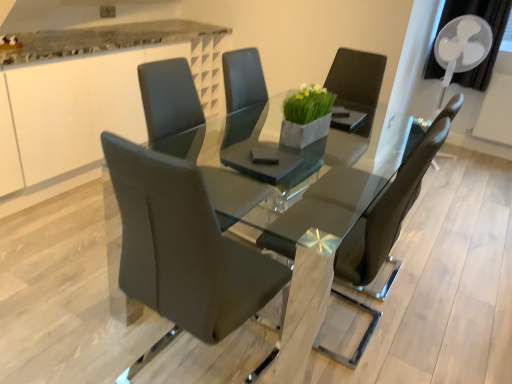
Question: In which direction should I rotate to look at matte black chair at center, which is counted as the first chair, starting from the front?

Choices:
 (A) right
 (B) left

Answer: (B)

Question: From the image's perspective, is high-gloss black table at center over matte black chair at center, the third chair viewed from the back?

Choices:
 (A) yes
 (B) no

Answer: (A)

Question: From a real-world perspective, is high-gloss black table at center positioned under matte black chair at center, which is counted as the first chair, starting from the front, based on gravity?

Choices:
 (A) yes
 (B) no

Answer: (A)

Question: Is high-gloss black table at center bigger than matte black chair at center, the third chair viewed from the back?

Choices:
 (A) yes
 (B) no

Answer: (A)

Question: Is high-gloss black table at center in contact with matte black chair at center, the third chair viewed from the back?

Choices:
 (A) yes
 (B) no

Answer: (B)

Question: Is high-gloss black table at center positioned behind matte black chair at center, the third chair viewed from the back?

Choices:
 (A) yes
 (B) no

Answer: (A)

Question: Does high-gloss black table at center have a greater width compared to matte black chair at center, the third chair viewed from the back?

Choices:
 (A) yes
 (B) no

Answer: (A)

Question: Is white plastic mechanical fan at upper right taller than high-gloss black table at center?

Choices:
 (A) no
 (B) yes

Answer: (B)

Question: Is white plastic mechanical fan at upper right touching high-gloss black table at center?

Choices:
 (A) no
 (B) yes

Answer: (A)

Question: From the image's perspective, is white plastic mechanical fan at upper right on top of high-gloss black table at center?

Choices:
 (A) no
 (B) yes

Answer: (B)

Question: Considering the relative positions of white plastic mechanical fan at upper right and high-gloss black table at center in the image provided, is white plastic mechanical fan at upper right to the right of high-gloss black table at center from the viewer's perspective?

Choices:
 (A) yes
 (B) no

Answer: (A)

Question: Is white plastic mechanical fan at upper right closer to camera compared to high-gloss black table at center?

Choices:
 (A) yes
 (B) no

Answer: (B)

Question: Is high-gloss black table at center at the back of white plastic mechanical fan at upper right?

Choices:
 (A) yes
 (B) no

Answer: (B)

Question: Is matte black chair at center, which is the 2th chair in front-to-back order, thinner than white plastic mechanical fan at upper right?

Choices:
 (A) yes
 (B) no

Answer: (B)